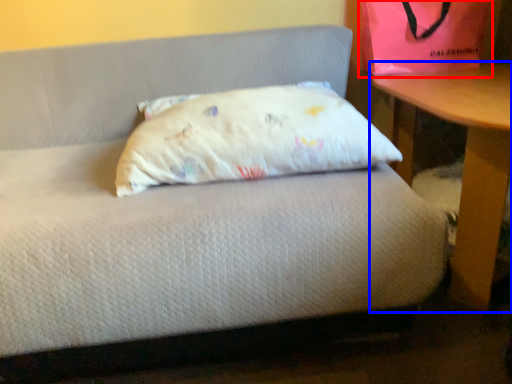
Question: Which point is closer to the camera, bean bag chair (highlighted by a red box) or table (highlighted by a blue box)?

Choices:
 (A) bean bag chair
 (B) table

Answer: (B)